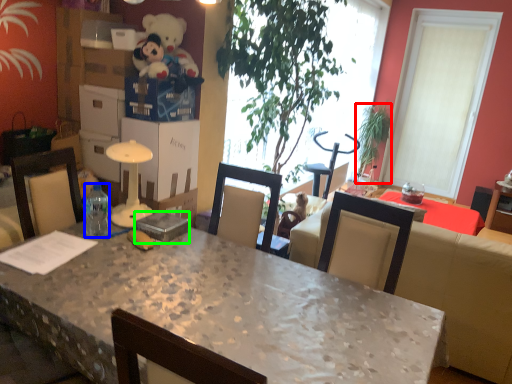
Question: Based on their relative distances, which object is nearer to houseplant (highlighted by a red box)? Choose from bottle (highlighted by a blue box) and box (highlighted by a green box).

Choices:
 (A) bottle
 (B) box

Answer: (B)